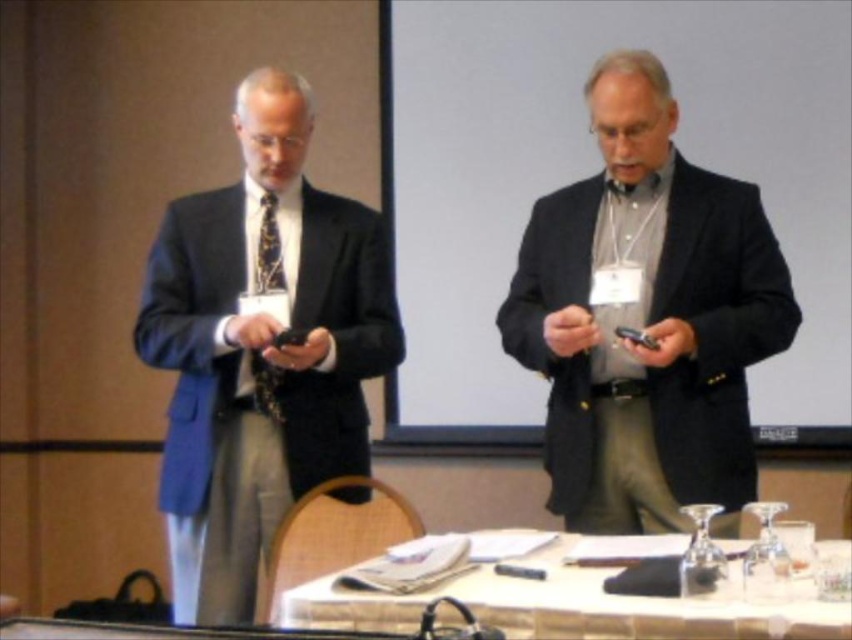
You are standing at the table in the conference room. You need to place a new item at point (292, 97) and point (609, 621). Which point is closer to the wall?

Point (292, 97) is behind point (609, 621), so placing an item at point (292, 97) would be closer to the wall.

You are a photographer setting up for a group photo. You need to ensure that the matte black suit at left and the white glossy table at lower center are both visible in the frame. Given their sizes, which object should you prioritize positioning closer to the camera to maintain clarity?

Since the matte black suit at left is thinner than the white glossy table at lower center, you should prioritize positioning the matte black suit at left closer to the camera to ensure it remains visible and clear in the photo.